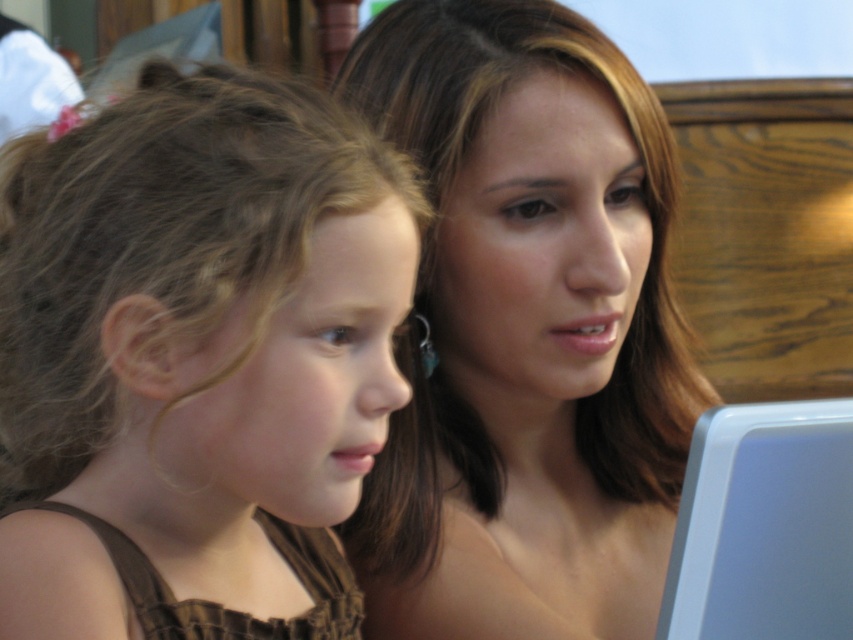
You are a photographer setting up a shoot. You have a brown fabric dress at left and a matte skin tone at center in your frame. Which item is shorter in height?

The brown fabric dress at left has a lesser height compared to matte skin tone at center, so the brown fabric dress at left is shorter in height.

You are a photographer setting up a shot of the two people in the scene. You need to ensure that the matte skin tone at center and the white plastic laptop at lower right are both visible in the frame. Based on their sizes, which object should you prioritize positioning closer to the camera to maintain clarity?

The matte skin tone at center has a greater height compared to the white plastic laptop at lower right. Therefore, to maintain clarity, you should prioritize positioning the white plastic laptop at lower right closer to the camera since it is smaller and might be harder to see from a distance.

You are a photographer setting up for a portrait. You have a camera with a narrow depth of field that can only focus on objects within a 10 cm range. The brown fabric dress at left and the matte skin tone at center are both in your frame. Which object should you focus on to ensure both are in focus?

The brown fabric dress at left has a lesser width compared to matte skin tone at center, so focusing on the matte skin tone at center would ensure both are within the 10 cm focus range since it is wider and closer in size to the dress.